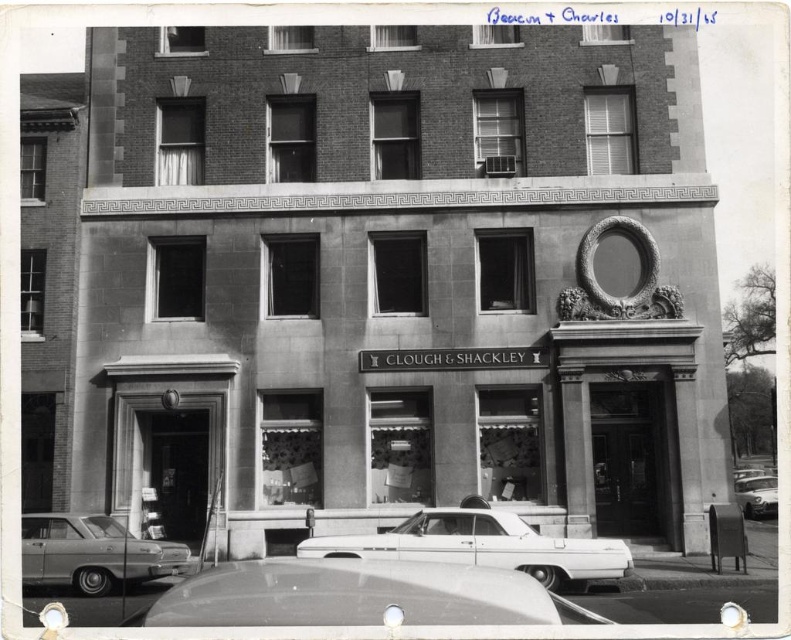
You are a photographer trying to capture the building in a wide shot. You notice two cars parked in front of it. Which car, the metallic gray sedan at lower left or the shiny silver car at lower right, will appear narrower in the photo?

The metallic gray sedan at lower left will appear narrower in the photo because it is thinner than the shiny silver car at lower right.

You are standing in front of the multi story brick building and want to park your car in the parking spot directly in front of the ground floor windows. The shiny white sedan at center is currently occupying that spot. Can you determine if there is enough space to park your car there?

The shiny white sedan at center is located at point [483,545], which is the exact position of the parking spot in front of the ground floor windows. Therefore, there is no available space to park your car there as it is already occupied by the shiny white sedan at center.

You are standing in front of the multi story brick building and want to park your car at the same spot where the shiny silver car at lower center is parked. According to the scene, where exactly is this parking spot located relative to the building?

The shiny silver car at lower center is located at point (358, 595), which means the parking spot is near the lower central area of the building, close to the ground floor windows with darker frames and the decorative Greek key pattern along the cornice.